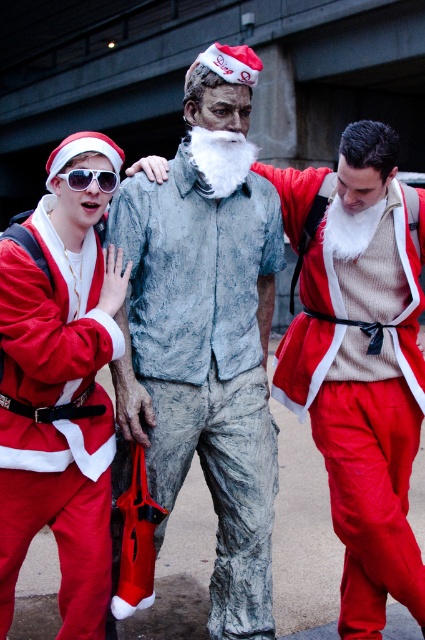
Question: Does matte red santa suit at center appear under white plastic sunglasses at upper left?

Choices:
 (A) yes
 (B) no

Answer: (A)

Question: Which point appears closest to the camera in this image?

Choices:
 (A) (116, 177)
 (B) (51, 241)
 (C) (175, 212)
 (D) (348, 589)

Answer: (B)

Question: Which of the following is the closest to the observer?

Choices:
 (A) fuzzy red santa suit at left
 (B) matte red santa suit at center

Answer: (A)

Question: Is gray textured suit at center closer to camera compared to matte red santa suit at center?

Choices:
 (A) no
 (B) yes

Answer: (A)

Question: Does gray textured suit at center come in front of white plastic sunglasses at upper left?

Choices:
 (A) yes
 (B) no

Answer: (B)

Question: Which of these objects is positioned farthest from the fuzzy red santa suit at left?

Choices:
 (A) matte red santa suit at center
 (B) white plastic sunglasses at upper left

Answer: (A)